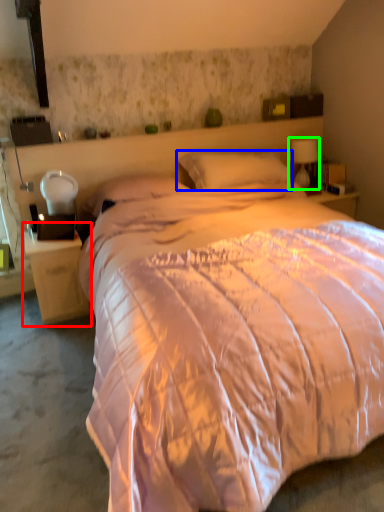
Question: Based on their relative distances, which object is farther from nightstand (highlighted by a red box)? Choose from pillow (highlighted by a blue box) and table lamp (highlighted by a green box).

Choices:
 (A) pillow
 (B) table lamp

Answer: (B)